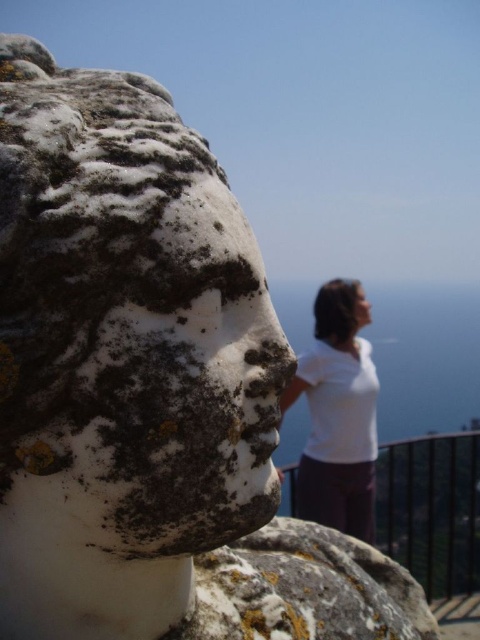
Question: Is white matte shirt at upper center smaller than blurred hair at upper center?

Choices:
 (A) no
 (B) yes

Answer: (A)

Question: Is white matte shirt at upper center in front of blurred hair at upper center?

Choices:
 (A) yes
 (B) no

Answer: (A)

Question: Which of the following is the closest to the observer?

Choices:
 (A) (360, 324)
 (B) (356, 417)

Answer: (B)

Question: Can you confirm if white matte shirt at upper center is thinner than blurred hair at upper center?

Choices:
 (A) yes
 (B) no

Answer: (B)

Question: Which object appears closest to the camera in this image?

Choices:
 (A) blurred hair at upper center
 (B) white matte shirt at upper center

Answer: (B)

Question: Which point appears closest to the camera in this image?

Choices:
 (A) click(349, 339)
 (B) click(351, 284)

Answer: (A)